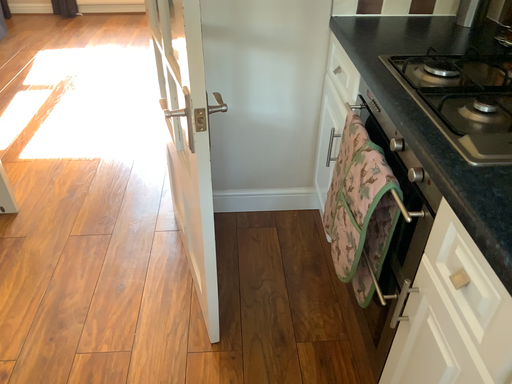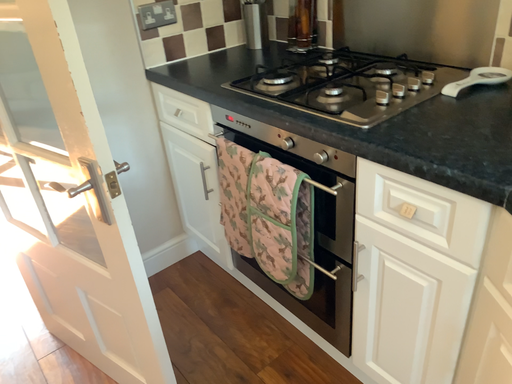
Question: How did the camera likely rotate when shooting the video?

Choices:
 (A) rotated right
 (B) rotated left

Answer: (A)